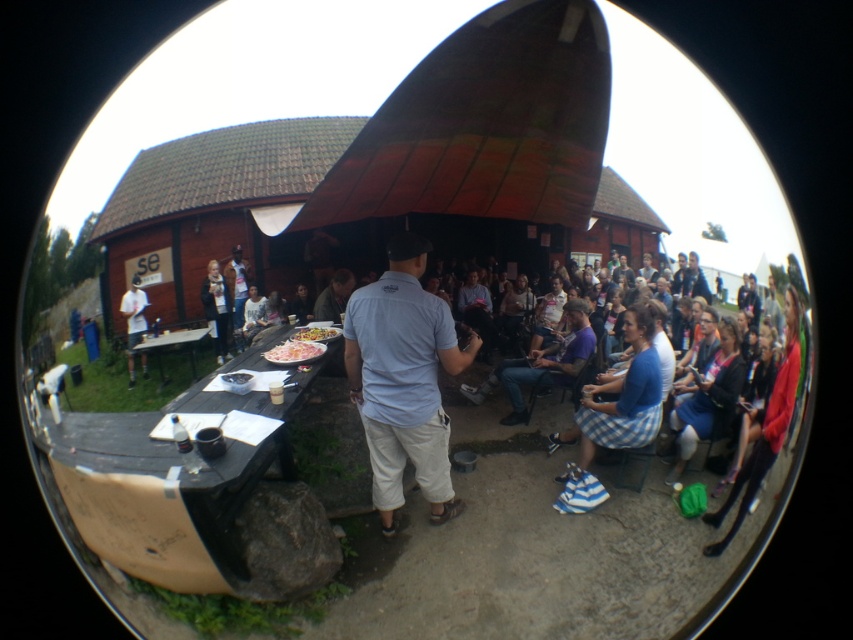
Looking at this image, you are a guest at this event and want to grab a plate. The light blue cotton shirt at center is an event staff member. Is the white glossy plate at center located above or below the staff member?

The light blue cotton shirt at center is below white glossy plate at center, so the white glossy plate at center is located above the staff member.

You are standing at the camera position and want to locate the light blue cotton shirt at center. According to the coordinates provided, where should you look to find it?

The light blue cotton shirt at center is located at coordinates point [403,380].